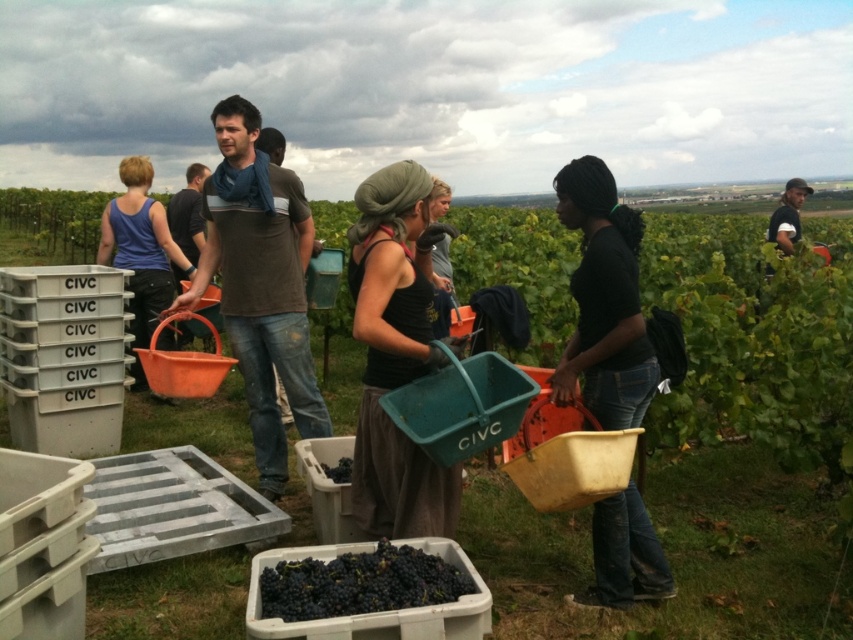
You are standing at the origin point of the image coordinate system. The grapes are located at point [361,582]. If you want to move towards the grapes, which direction should you walk?

The grapes are located at point [361,582], which is to the right and slightly above your current position. You should walk towards the right and upwards to reach them.

You are a worker in the vineyard and need to choose between two baskets of grapes to carry. The baskets are labeled as dark matte grapes at center and dark purple grapes at center. Which basket has a larger width?

The dark matte grapes at center has a larger width than the dark purple grapes at center.